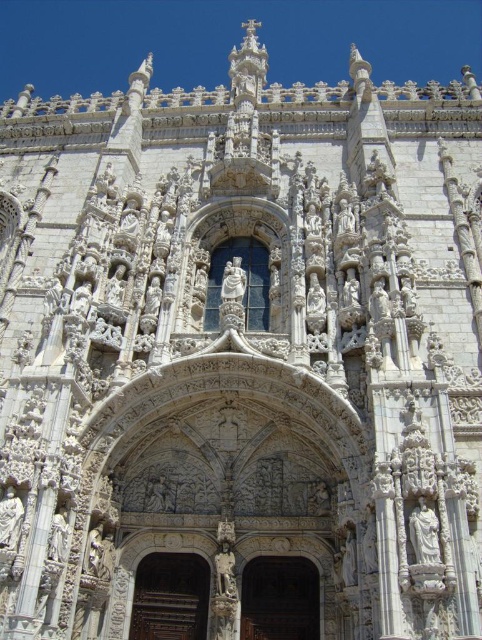
Where is `wooden door at center`? This screenshot has width=482, height=640. wooden door at center is located at coordinates (170, 596).

Looking at this image, between wooden door at center and brown wood door at center, which one is positioned higher?

wooden door at center is above.

Between point (137, 588) and point (265, 573), which one is positioned in front?

Positioned in front is point (137, 588).

Find the location of a particular element. The height and width of the screenshot is (640, 482). wooden door at center is located at coordinates (170, 596).